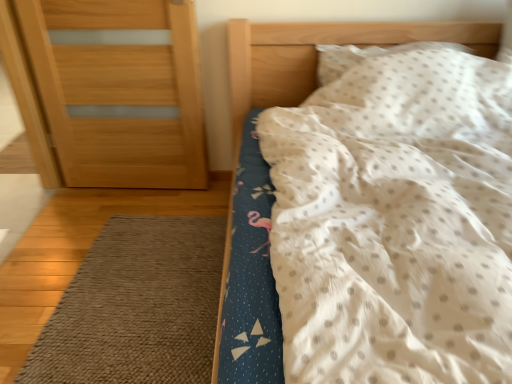
Question: From the image's perspective, relative to wooden door at left, is white dotted pillow at upper right above or below?

Choices:
 (A) below
 (B) above

Answer: (B)

Question: Considering the positions of white dotted pillow at upper right and wooden door at left in the image, is white dotted pillow at upper right wider or thinner than wooden door at left?

Choices:
 (A) wide
 (B) thin

Answer: (A)

Question: Based on their relative distances, which object is nearer to the white dotted fabric at upper right?

Choices:
 (A) white dotted pillow at upper right
 (B) wooden door at left
 (C) brown textured rug at lower left

Answer: (A)

Question: Which is nearer to the wooden door at left?

Choices:
 (A) white dotted fabric at upper right
 (B) brown textured rug at lower left
 (C) white dotted pillow at upper right

Answer: (A)